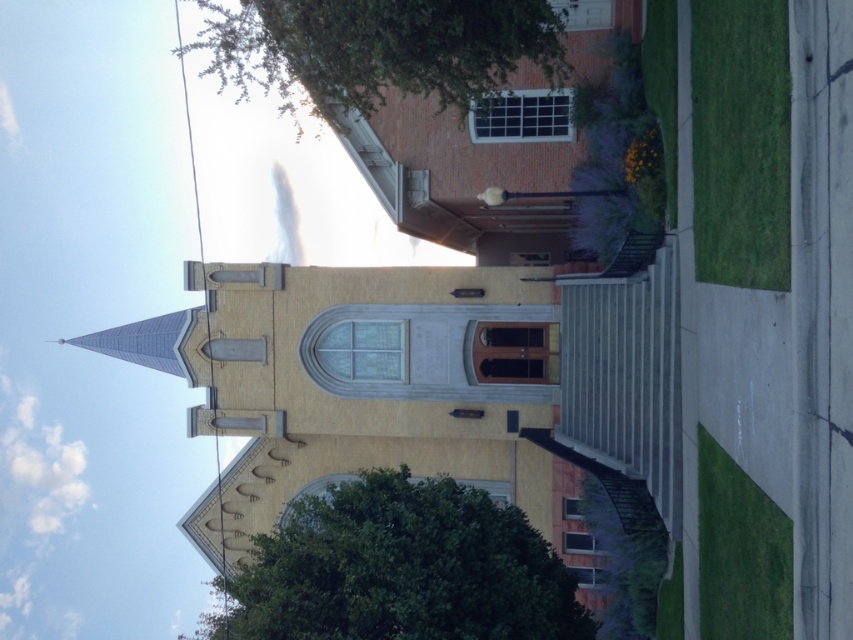
Question: Can you confirm if green leafy tree at center is positioned to the left of green leafy tree at upper center?

Choices:
 (A) no
 (B) yes

Answer: (A)

Question: Is green leafy tree at center wider than green leafy tree at upper center?

Choices:
 (A) yes
 (B) no

Answer: (B)

Question: Among these objects, which one is farthest from the camera?

Choices:
 (A) green leafy tree at center
 (B) green leafy tree at upper center

Answer: (B)

Question: Which point is farther to the camera?

Choices:
 (A) (367, 86)
 (B) (473, 624)

Answer: (A)

Question: Is green leafy tree at center further to the viewer compared to green leafy tree at upper center?

Choices:
 (A) yes
 (B) no

Answer: (B)

Question: Which of the following is the closest to the observer?

Choices:
 (A) (547, 627)
 (B) (392, 51)

Answer: (A)